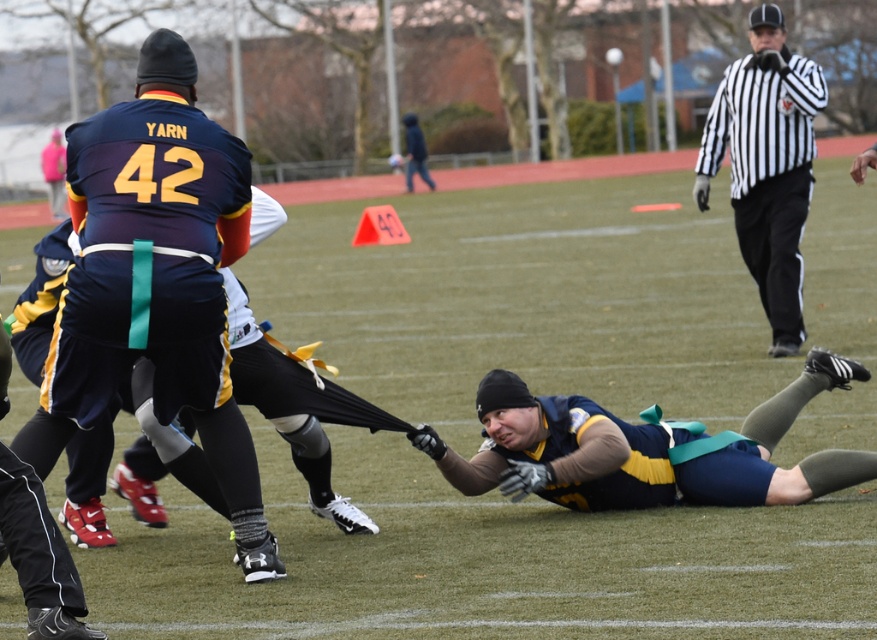
Question: Does matte blue jersey at upper left lie in front of black and white striped shirt at upper right?

Choices:
 (A) yes
 (B) no

Answer: (A)

Question: Can you confirm if matte blue jersey at upper left is positioned above dark blue jacket at upper center?

Choices:
 (A) no
 (B) yes

Answer: (A)

Question: Which point is closer to the camera?

Choices:
 (A) matte blue jersey at upper left
 (B) black and white striped shirt at upper right
 (C) dark blue jacket at upper center
 (D) matte blue jersey at center

Answer: (A)

Question: Which object is the farthest from the black and white striped shirt at upper right?

Choices:
 (A) dark blue jacket at upper center
 (B) matte blue jersey at center

Answer: (A)

Question: Does black and white striped shirt at upper right have a larger size compared to dark blue jacket at upper center?

Choices:
 (A) no
 (B) yes

Answer: (A)

Question: Which is farther from the matte blue jersey at upper left?

Choices:
 (A) dark blue jacket at upper center
 (B) black and white striped shirt at upper right
 (C) matte blue jersey at center

Answer: (A)